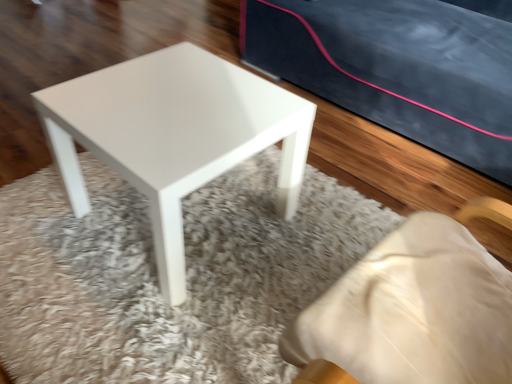
The height and width of the screenshot is (384, 512). What do you see at coordinates (174, 135) in the screenshot?
I see `white glossy stool at center` at bounding box center [174, 135].

The width and height of the screenshot is (512, 384). Find the location of `white glossy stool at center`. white glossy stool at center is located at coordinates (174, 135).

Describe the element at coordinates (156, 276) in the screenshot. I see `matte black mat at upper center` at that location.

Where is `matte black mat at upper center`? The height and width of the screenshot is (384, 512). matte black mat at upper center is located at coordinates (156, 276).

Where is `white glossy stool at center`? white glossy stool at center is located at coordinates (174, 135).

Can you confirm if white glossy stool at center is positioned to the left of matte black mat at upper center?

Correct, you'll find white glossy stool at center to the left of matte black mat at upper center.

Is white glossy stool at center positioned in front of matte black mat at upper center?

No, white glossy stool at center is further to the viewer.

Which is further, [250,76] or [270,381]?

The point [250,76] is farther.

From the image's perspective, who appears lower, white glossy stool at center or matte black mat at upper center?

matte black mat at upper center appears lower in the image.

From a real-world perspective, which is physically below, white glossy stool at center or matte black mat at upper center?

matte black mat at upper center is physically lower.

Considering the relative sizes of white glossy stool at center and matte black mat at upper center in the image provided, is white glossy stool at center thinner than matte black mat at upper center?

Yes.

Who is shorter, white glossy stool at center or matte black mat at upper center?

Standing shorter between the two is matte black mat at upper center.

Considering the sizes of white glossy stool at center and matte black mat at upper center in the image, is white glossy stool at center bigger or smaller than matte black mat at upper center?

Considering their sizes, white glossy stool at center takes up less space than matte black mat at upper center.

Do you think white glossy stool at center is within matte black mat at upper center, or outside of it?

white glossy stool at center is located beyond the bounds of matte black mat at upper center.

Is white glossy stool at center directly adjacent to matte black mat at upper center?

They are not placed beside each other.

Is white glossy stool at center facing away from matte black mat at upper center?

No.

In order to click on stool behind the matte black mat at upper center in this screenshot , I will do `click(174, 135)`.

Is matte black mat at upper center to the left or to the right of white glossy stool at center in the image?

matte black mat at upper center is to the right of white glossy stool at center.

Which object is closer to the camera taking this photo, matte black mat at upper center or white glossy stool at center?

matte black mat at upper center is closer to the camera.

Does point (266, 348) come farther from viewer compared to point (97, 143)?

Yes, it is behind point (97, 143).

From the image's perspective, which object appears higher, matte black mat at upper center or white glossy stool at center?

white glossy stool at center is shown above in the image.

From a real-world perspective, which is physically above, matte black mat at upper center or white glossy stool at center?

white glossy stool at center is physically above.

Does matte black mat at upper center have a greater width compared to white glossy stool at center?

Yes.

From their relative heights in the image, would you say matte black mat at upper center is taller or shorter than white glossy stool at center?

Considering their sizes, matte black mat at upper center has less height than white glossy stool at center.

Considering the sizes of matte black mat at upper center and white glossy stool at center in the image, is matte black mat at upper center bigger or smaller than white glossy stool at center?

Considering their sizes, matte black mat at upper center takes up more space than white glossy stool at center.

Is matte black mat at upper center not inside white glossy stool at center?

That's correct, matte black mat at upper center is outside of white glossy stool at center.

Is matte black mat at upper center touching white glossy stool at center?

matte black mat at upper center and white glossy stool at center are not in contact.

Is matte black mat at upper center facing towards white glossy stool at center?

No, matte black mat at upper center is not aimed at white glossy stool at center.

What's the angular difference between matte black mat at upper center and white glossy stool at center's facing directions?

0.513 degrees separate the facing orientations of matte black mat at upper center and white glossy stool at center.

The height and width of the screenshot is (384, 512). I want to click on stool lying above the matte black mat at upper center (from the image's perspective), so click(174, 135).

Find the location of a particular element. The height and width of the screenshot is (384, 512). stool that appears above the matte black mat at upper center (from a real-world perspective) is located at coordinates (174, 135).

Identify the location of mat that is below the white glossy stool at center (from the image's perspective). (156, 276).